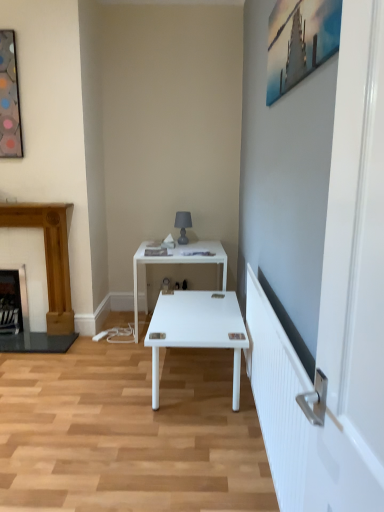
Question: Considering the relative sizes of metallic silver painting at upper right, the second picture frame positioned from the left, and metallic glass picture frame at upper left, the 1th picture frame viewed from the left, in the image provided, is metallic silver painting at upper right, the second picture frame positioned from the left, bigger than metallic glass picture frame at upper left, the 1th picture frame viewed from the left,?

Choices:
 (A) no
 (B) yes

Answer: (B)

Question: Is metallic silver painting at upper right, placed as the 1th picture frame when sorted from right to left, thinner than metallic glass picture frame at upper left, which appears as the second picture frame when viewed from the right?

Choices:
 (A) no
 (B) yes

Answer: (B)

Question: Considering the relative sizes of metallic silver painting at upper right, which is the 1th picture frame in front-to-back order, and metallic glass picture frame at upper left, acting as the 2th picture frame starting from the front, in the image provided, is metallic silver painting at upper right, which is the 1th picture frame in front-to-back order, shorter than metallic glass picture frame at upper left, acting as the 2th picture frame starting from the front,?

Choices:
 (A) yes
 (B) no

Answer: (A)

Question: Is metallic silver painting at upper right, which is the 1th picture frame in front-to-back order, at the right side of metallic glass picture frame at upper left, acting as the 2th picture frame starting from the front?

Choices:
 (A) no
 (B) yes

Answer: (B)

Question: Is metallic silver painting at upper right, the second picture frame positioned from the left, in contact with metallic glass picture frame at upper left, acting as the 2th picture frame starting from the front?

Choices:
 (A) no
 (B) yes

Answer: (A)

Question: From the image's perspective, is black metal fireplace at left, placed as the 2th fireplace when sorted from right to left, above or below wooden fireplace at left, which is the 1th fireplace in right-to-left order?

Choices:
 (A) below
 (B) above

Answer: (A)

Question: Is black metal fireplace at left, the 1th fireplace from the left, taller or shorter than wooden fireplace at left, which is the 1th fireplace in right-to-left order?

Choices:
 (A) short
 (B) tall

Answer: (A)

Question: Visually, is black metal fireplace at left, the 1th fireplace from the left, positioned to the left or to the right of wooden fireplace at left, which is the 1th fireplace in right-to-left order?

Choices:
 (A) right
 (B) left

Answer: (B)

Question: Choose the correct answer: Is black metal fireplace at left, placed as the 2th fireplace when sorted from right to left, inside wooden fireplace at left, which is the 1th fireplace in right-to-left order, or outside it?

Choices:
 (A) outside
 (B) inside

Answer: (B)

Question: Is white glossy desk at center taller or shorter than wooden fireplace at left, which is the 1th fireplace in right-to-left order?

Choices:
 (A) tall
 (B) short

Answer: (B)

Question: In terms of size, does white glossy desk at center appear bigger or smaller than wooden fireplace at left, placed as the second fireplace when sorted from left to right?

Choices:
 (A) big
 (B) small

Answer: (A)

Question: From a real-world perspective, is white glossy desk at center positioned above or below wooden fireplace at left, placed as the second fireplace when sorted from left to right?

Choices:
 (A) above
 (B) below

Answer: (B)

Question: In the image, is white glossy desk at center on the left side or the right side of wooden fireplace at left, which is the 1th fireplace in right-to-left order?

Choices:
 (A) left
 (B) right

Answer: (B)

Question: Based on their sizes in the image, would you say matte gray lamp at upper center is bigger or smaller than black metal fireplace at left, the 1th fireplace from the left?

Choices:
 (A) big
 (B) small

Answer: (B)

Question: Is matte gray lamp at upper center situated inside black metal fireplace at left, placed as the 2th fireplace when sorted from right to left, or outside?

Choices:
 (A) inside
 (B) outside

Answer: (B)